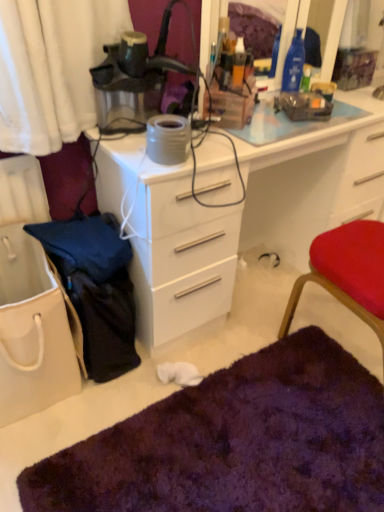
The width and height of the screenshot is (384, 512). Identify the location of vacant region to the right of matte gray coffee cup at upper right. (363, 101).